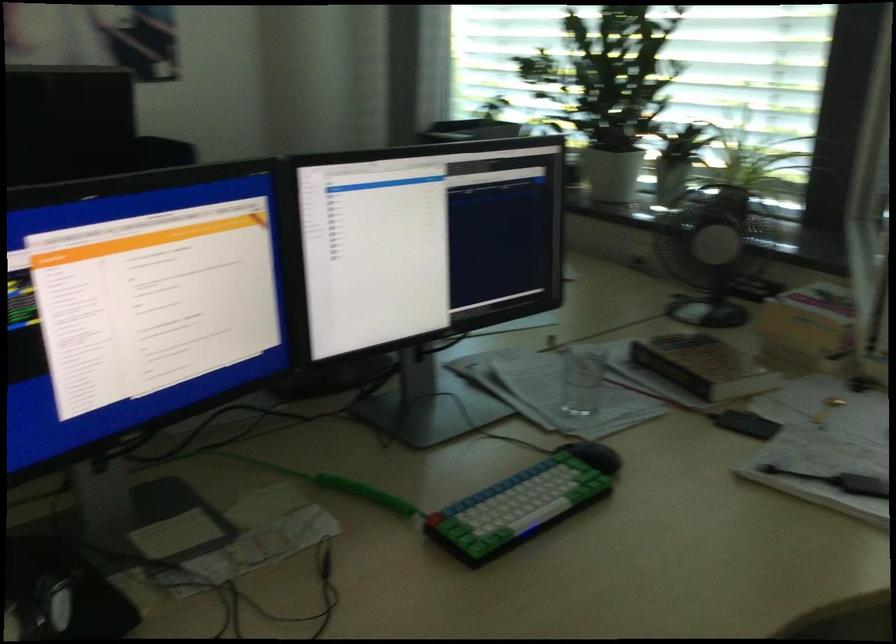
This screenshot has height=644, width=896. Identify the location of small black fan. (711, 252).